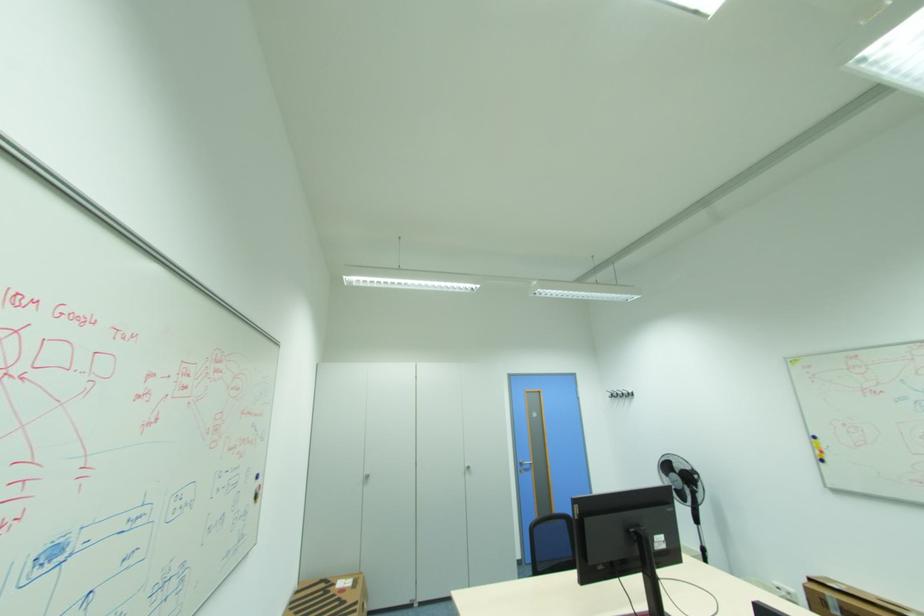
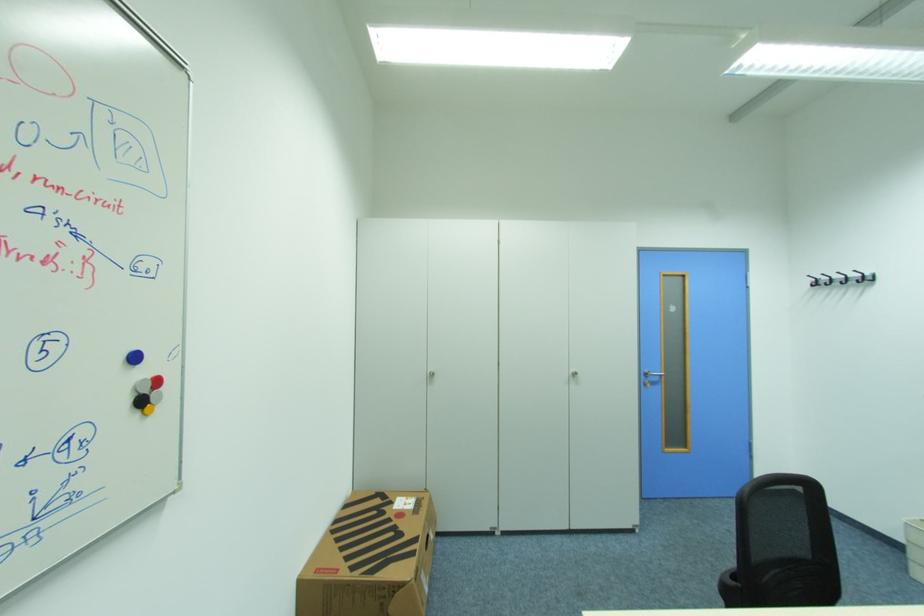
The point at (261, 496) is marked in the first image. Where is the corresponding point in the second image?

(146, 403)